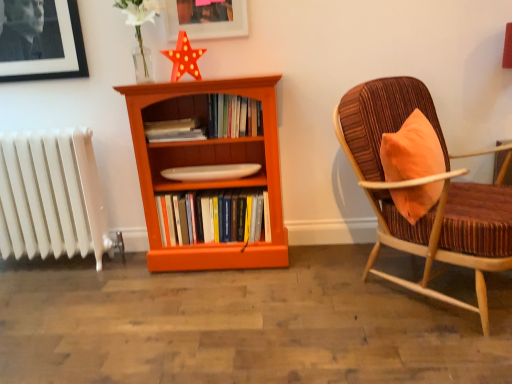
You are a GUI agent. You are given a task and a screenshot of the screen. Output one action in this format:
    pyautogui.click(x=<x>, y=<y>)
    Task: Click on the white painted radiator at left
    This screenshot has height=384, width=512.
    Given the screenshot: What is the action you would take?
    pyautogui.click(x=53, y=194)

The image size is (512, 384). What do you see at coordinates (206, 164) in the screenshot?
I see `orange wood bookcase at center` at bounding box center [206, 164].

The width and height of the screenshot is (512, 384). Describe the element at coordinates (213, 217) in the screenshot. I see `hardcover books at center, which is counted as the 1th book, starting from the bottom` at that location.

Describe the element at coordinates (424, 184) in the screenshot. Image resolution: width=512 pixels, height=384 pixels. I see `velvet brown chair with wooden frame at right` at that location.

Find the location of a particular element. This screenshot has width=512, height=384. velvet brown chair with wooden frame at right is located at coordinates (424, 184).

Find the location of a particular element. The image size is (512, 384). white painted radiator at left is located at coordinates (53, 194).

From a real-world perspective, which is physically above, orange wood bookcase at center or hardcover books at center, marked as the 3th book in a top-to-bottom arrangement?

orange wood bookcase at center is physically above.

Based on their sizes in the image, would you say orange wood bookcase at center is bigger or smaller than hardcover books at center, marked as the 3th book in a top-to-bottom arrangement?

orange wood bookcase at center is bigger than hardcover books at center, marked as the 3th book in a top-to-bottom arrangement.

Which object is more forward, orange wood bookcase at center or hardcover books at center, which is counted as the 1th book, starting from the bottom?

orange wood bookcase at center is in front.

In the image, is hardcover books at center, which is counted as the 1th book, starting from the bottom, positioned in front of or behind matte white picture frame at upper center?

Visually, hardcover books at center, which is counted as the 1th book, starting from the bottom, is located behind matte white picture frame at upper center.

Are hardcover books at center, marked as the 3th book in a top-to-bottom arrangement, and matte white picture frame at upper center far apart?

hardcover books at center, marked as the 3th book in a top-to-bottom arrangement, is near matte white picture frame at upper center, not far away.

How many degrees apart are the facing directions of hardcover books at center, which is counted as the 1th book, starting from the bottom, and matte white picture frame at upper center?

hardcover books at center, which is counted as the 1th book, starting from the bottom, and matte white picture frame at upper center are facing 0.000589 degrees away from each other.

Between hardcover books at center, which is counted as the 1th book, starting from the bottom, and matte white picture frame at upper center, which one has smaller width?

matte white picture frame at upper center.

Is matte orange book at center, which is the 2th book from top to bottom, far from hardcover books at center, the 1th book positioned from the top?

That's not correct — matte orange book at center, which is the 2th book from top to bottom, is a little close to hardcover books at center, the 1th book positioned from the top.

Considering the relative sizes of matte orange book at center, which is the 2th book from top to bottom, and hardcover books at center, the 1th book positioned from the top, in the image provided, is matte orange book at center, which is the 2th book from top to bottom, taller than hardcover books at center, the 1th book positioned from the top,?

No.

Find the location of a particular element. The image size is (512, 384). the 2nd book to the right of the matte orange book at center, which is the 2th book from top to bottom, starting your count from the anchor is located at coordinates (233, 116).

Which is correct: matte orange book at center, which ranks as the second book in bottom-to-top order, is inside hardcover books at center, the 1th book positioned from the top, or outside of it?

matte orange book at center, which ranks as the second book in bottom-to-top order, is not enclosed by hardcover books at center, the 1th book positioned from the top.

Which is more to the right, luminous plastic star at upper center or matte orange book at center, which is the 2th book from top to bottom?

luminous plastic star at upper center is more to the right.

From a real-world perspective, starting from the luminous plastic star at upper center, which book is the 2nd one below it? Please provide its 2D coordinates.

[(175, 130)]

Between luminous plastic star at upper center and matte orange book at center, which is the 2th book from top to bottom, which one has larger width?

matte orange book at center, which is the 2th book from top to bottom.

Is white painted radiator at left taller than hardcover books at center, marked as the 3th book in a top-to-bottom arrangement?

Yes.

Is white painted radiator at left not near hardcover books at center, which is counted as the 1th book, starting from the bottom?

No, white painted radiator at left is in close proximity to hardcover books at center, which is counted as the 1th book, starting from the bottom.

From a real-world perspective, which is physically above, white painted radiator at left or hardcover books at center, marked as the 3th book in a top-to-bottom arrangement?

white painted radiator at left.

Which is further, (204, 205) or (44, 243)?

Positioned behind is point (44, 243).

Based on the photo, considering the relative sizes of hardcover books at center, which is counted as the 1th book, starting from the bottom, and white painted radiator at left in the image provided, is hardcover books at center, which is counted as the 1th book, starting from the bottom, thinner than white painted radiator at left?

Incorrect, the width of hardcover books at center, which is counted as the 1th book, starting from the bottom, is not less than that of white painted radiator at left.

Measure the distance from hardcover books at center, which is counted as the 1th book, starting from the bottom, to white painted radiator at left.

hardcover books at center, which is counted as the 1th book, starting from the bottom, and white painted radiator at left are 25.47 inches apart from each other.

From the image's perspective, is hardcover books at center, which is counted as the 1th book, starting from the bottom, over white painted radiator at left?

Incorrect, from the image's perspective, hardcover books at center, which is counted as the 1th book, starting from the bottom, is lower than white painted radiator at left.

Can you confirm if white painted radiator at left is positioned to the left of white matte flower at upper center?

Yes.

From the image's perspective, is white painted radiator at left beneath white matte flower at upper center?

Yes.

Which object is further away from the camera, white painted radiator at left or white matte flower at upper center?

white painted radiator at left is further away from the camera.

Does white painted radiator at left turn towards white matte flower at upper center?

No, white painted radiator at left is not facing towards white matte flower at upper center.

Starting from the orange wood bookcase at center, which book is the 1st one to the right? Please provide its 2D coordinates.

[(213, 217)]

This screenshot has width=512, height=384. Find the location of `picture frame that is on the left side of hardcover books at center, marked as the 3th book in a top-to-bottom arrangement`. picture frame that is on the left side of hardcover books at center, marked as the 3th book in a top-to-bottom arrangement is located at coordinates (206, 19).

From the image, which object appears to be farther from velvet brown chair with wooden frame at right, matte white picture frame at upper center or matte orange book at center, which is the 2th book from top to bottom?

The object further to velvet brown chair with wooden frame at right is matte white picture frame at upper center.

Which object lies further to the anchor point hardcover books at center, which is the third book in bottom-to-top order, matte white picture frame at upper center or matte orange book at center, which ranks as the second book in bottom-to-top order?

matte white picture frame at upper center is positioned further to the anchor hardcover books at center, which is the third book in bottom-to-top order.

When comparing their distances from white matte flower at upper center, does hardcover books at center, which is counted as the 1th book, starting from the bottom, or velvet brown chair with wooden frame at right seem closer?

hardcover books at center, which is counted as the 1th book, starting from the bottom, is positioned closer to the anchor white matte flower at upper center.

Looking at the image, which one is located closer to matte orange book at center, which ranks as the second book in bottom-to-top order, velvet brown chair with wooden frame at right or orange wood bookcase at center?

orange wood bookcase at center is closer to matte orange book at center, which ranks as the second book in bottom-to-top order.

Which object lies nearer to the anchor point velvet brown chair with wooden frame at right, luminous plastic star at upper center or hardcover books at center, marked as the 3th book in a top-to-bottom arrangement?

Based on the image, hardcover books at center, marked as the 3th book in a top-to-bottom arrangement, appears to be nearer to velvet brown chair with wooden frame at right.

Based on their spatial positions, is white painted radiator at left or white matte flower at upper center closer to matte orange book at center, which ranks as the second book in bottom-to-top order?

white matte flower at upper center is positioned closer to the anchor matte orange book at center, which ranks as the second book in bottom-to-top order.

Looking at the image, which one is located closer to matte white picture frame at upper center, hardcover books at center, marked as the 3th book in a top-to-bottom arrangement, or matte orange book at center, which is the 2th book from top to bottom?

matte orange book at center, which is the 2th book from top to bottom, lies closer to matte white picture frame at upper center than the other object.

Consider the image. When comparing their distances from hardcover books at center, which is the third book in bottom-to-top order, does matte orange book at center, which is the 2th book from top to bottom, or white painted radiator at left seem further?

white painted radiator at left is further to hardcover books at center, which is the third book in bottom-to-top order.

This screenshot has height=384, width=512. Identify the location of bookcase between hardcover books at center, the 1th book positioned from the top, and hardcover books at center, which is counted as the 1th book, starting from the bottom, vertically. (206, 164).

Image resolution: width=512 pixels, height=384 pixels. Find the location of `star located between matte orange book at center, which is the 2th book from top to bottom, and velvet brown chair with wooden frame at right in the left-right direction`. star located between matte orange book at center, which is the 2th book from top to bottom, and velvet brown chair with wooden frame at right in the left-right direction is located at coordinates (184, 58).

In order to click on flower between matte white picture frame at upper center and white painted radiator at left vertically in this screenshot , I will do `click(140, 32)`.

Where is `picture frame between matte orange book at center, which ranks as the second book in bottom-to-top order, and velvet brown chair with wooden frame at right from left to right`? The width and height of the screenshot is (512, 384). picture frame between matte orange book at center, which ranks as the second book in bottom-to-top order, and velvet brown chair with wooden frame at right from left to right is located at coordinates (206, 19).